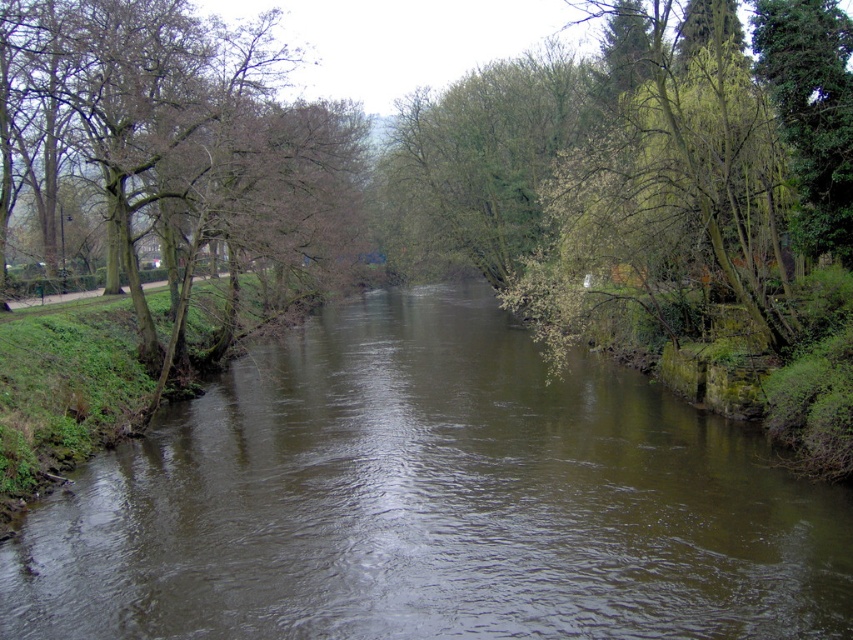
You are a hiker standing at the edge of the river and want to cross it. The brown leafy tree at left is blocking your path. Can you walk around the tree to reach the other side of the brown muddy stream at center?

The brown muddy stream at center is shorter than the brown leafy tree at left, so you can walk around the tree to reach the other side of the brown muddy stream at center since the stream is not as tall as the tree.

You are standing on the riverbank and want to cross to the opposite side. You see the brown muddy stream at center and the brown leafy tree at left. Which object is closer to you, the observer?

The brown muddy stream at center is closer to you because it is in front of the brown leafy tree at left.

You are a hiker trying to cross the river using the brown muddy stream at center and the brown leafy tree at left. Which path is narrower and therefore safer for crossing?

The brown muddy stream at center has a smaller size compared to the brown leafy tree at left, so the brown muddy stream at center is narrower and safer for crossing.